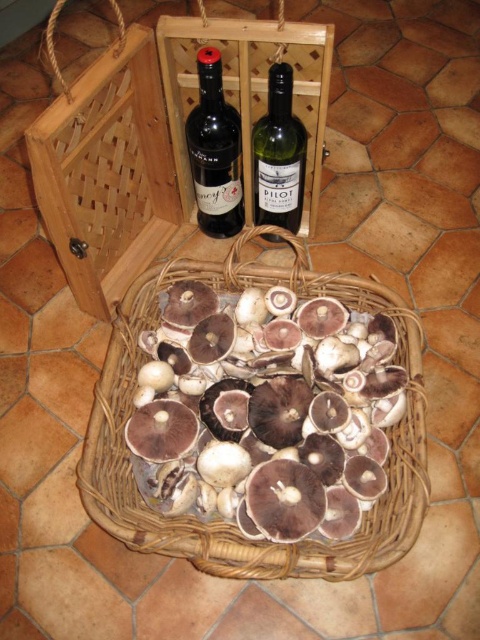
Does woven brown basket at center appear over green glass bottle at upper center?

Actually, woven brown basket at center is below green glass bottle at upper center.

Which is more to the left, woven brown basket at center or green glass bottle at upper center?

woven brown basket at center

Between point (389, 291) and point (295, 173), which one is positioned behind?

Point (295, 173)

Locate an element on the screen. The width and height of the screenshot is (480, 640). woven brown basket at center is located at coordinates (219, 520).

Can you confirm if matte glass wine bottle at upper center is thinner than green glass bottle at upper center?

Incorrect, matte glass wine bottle at upper center's width is not less than green glass bottle at upper center's.

Can you confirm if matte glass wine bottle at upper center is positioned above green glass bottle at upper center?

Correct, matte glass wine bottle at upper center is located above green glass bottle at upper center.

Where is `matte glass wine bottle at upper center`? The image size is (480, 640). matte glass wine bottle at upper center is located at coordinates (215, 150).

Does woven brown basket at center have a larger size compared to matte glass wine bottle at upper center?

Yes, woven brown basket at center is bigger than matte glass wine bottle at upper center.

Which is more to the right, woven brown basket at center or matte glass wine bottle at upper center?

From the viewer's perspective, woven brown basket at center appears more on the right side.

You are a GUI agent. You are given a task and a screenshot of the screen. Output one action in this format:
    pyautogui.click(x=<x>, y=<y>)
    Task: Click on the woven brown basket at center
    This screenshot has width=480, height=640.
    Given the screenshot: What is the action you would take?
    pyautogui.click(x=219, y=520)

The width and height of the screenshot is (480, 640). I want to click on woven brown basket at center, so click(219, 520).